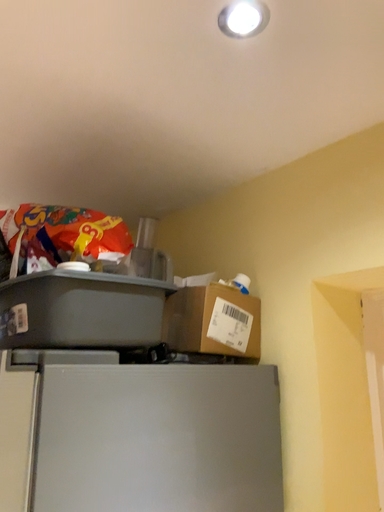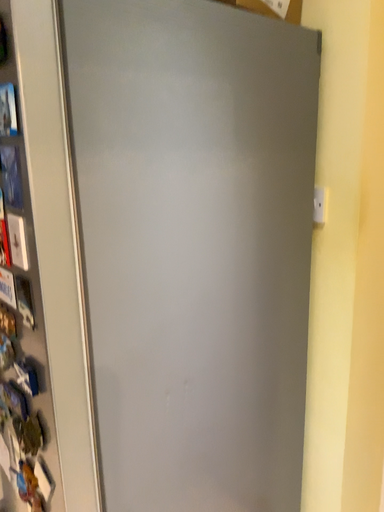
Question: How did the camera likely rotate when shooting the video?

Choices:
 (A) rotated downward
 (B) rotated upward

Answer: (A)